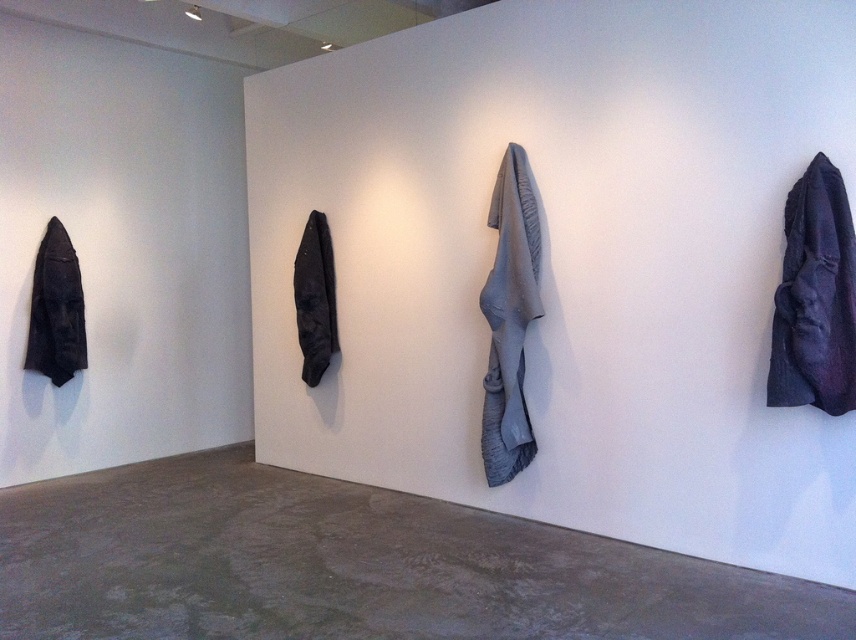
Question: Can you confirm if gray fabric at center is wider than matte black jacket at center?

Choices:
 (A) yes
 (B) no

Answer: (A)

Question: Which object appears closest to the camera in this image?

Choices:
 (A) matte black jacket at left
 (B) gray fabric at center

Answer: (B)

Question: Does matte black jacket at left have a smaller size compared to matte black jacket at center?

Choices:
 (A) yes
 (B) no

Answer: (B)

Question: Estimate the real-world distances between objects in this image. Which object is closer to the matte black jacket at center?

Choices:
 (A) dark matte fabric at right
 (B) matte black jacket at left
 (C) gray fabric at center

Answer: (C)

Question: Is matte black jacket at left to the left of matte black jacket at center from the viewer's perspective?

Choices:
 (A) no
 (B) yes

Answer: (B)

Question: Which of these objects is positioned closest to the gray fabric at center?

Choices:
 (A) matte black jacket at center
 (B) dark matte fabric at right
 (C) matte black jacket at left

Answer: (B)